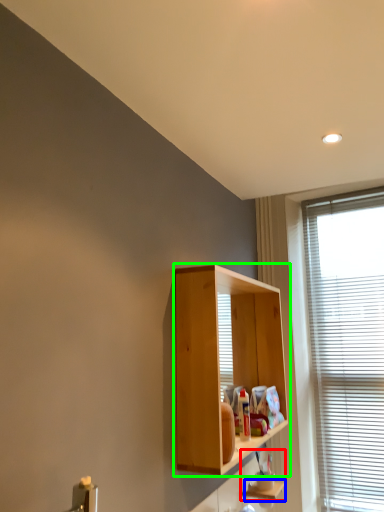
Question: Considering the real-world distances, which object is closest to cabinet (highlighted by a red box)? shelf (highlighted by a blue box) or cabinetry (highlighted by a green box).

Choices:
 (A) shelf
 (B) cabinetry

Answer: (A)